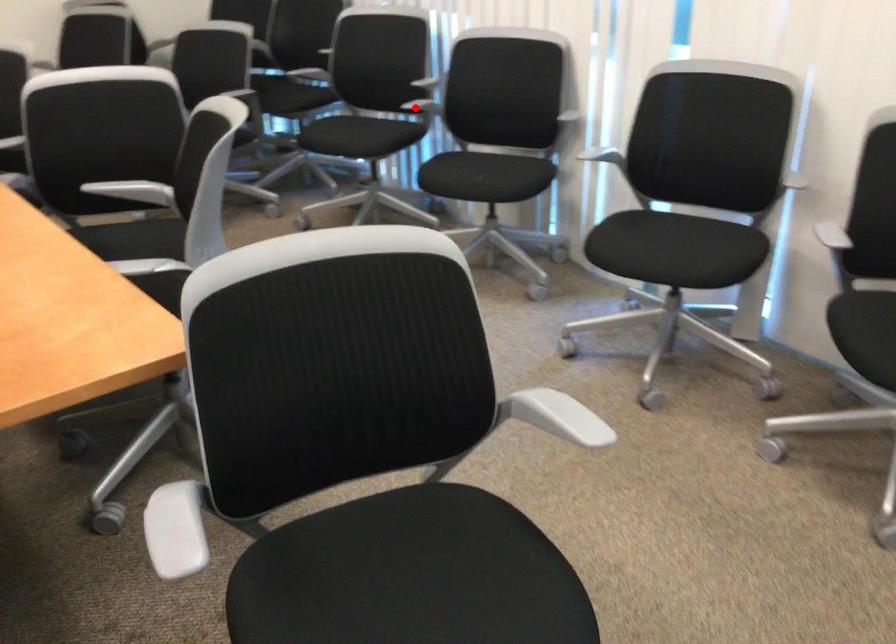
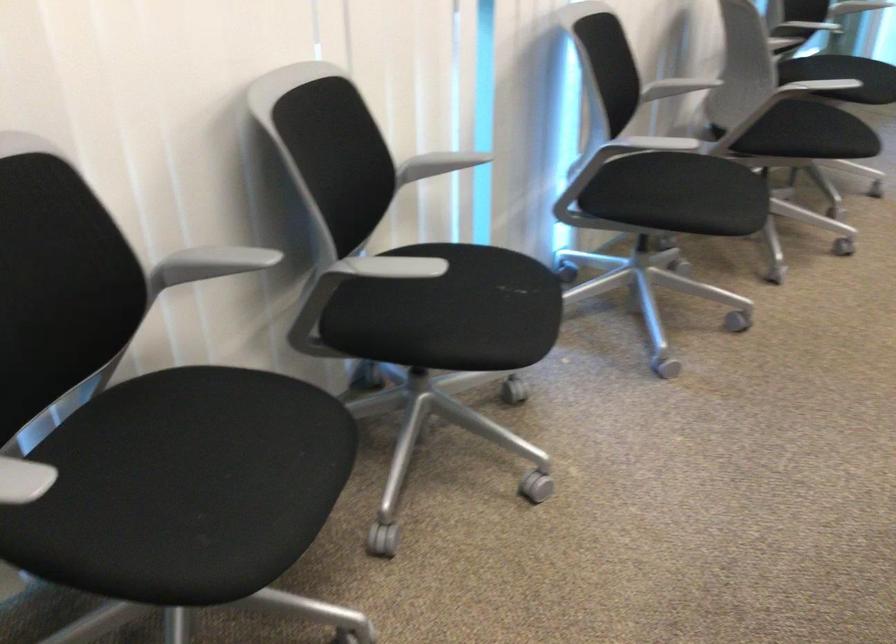
Where in the second image is the point corresponding to the highlighted location from the first image?

(384, 267)